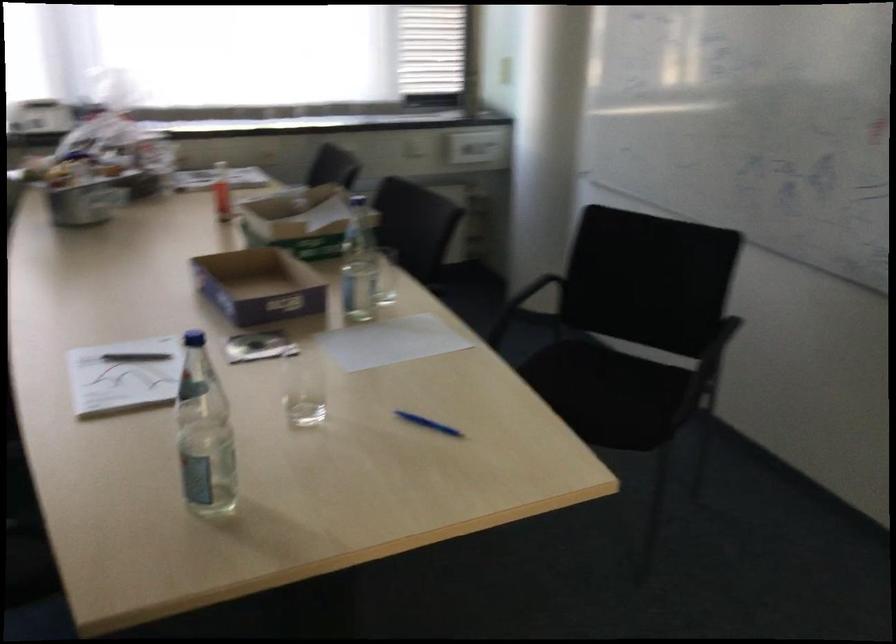
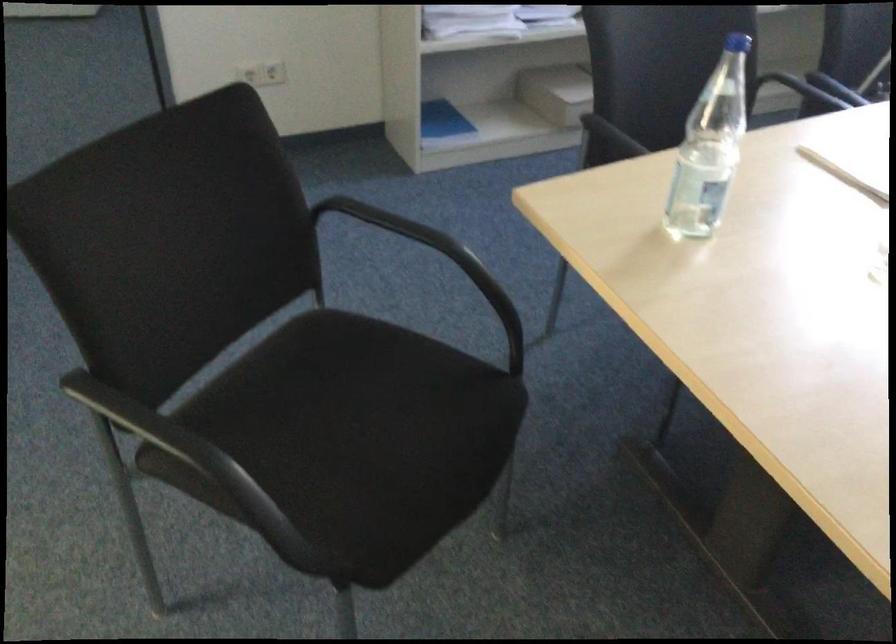
Based on the continuous images, in which direction is the camera rotating?

The camera's rotation is toward left-down.